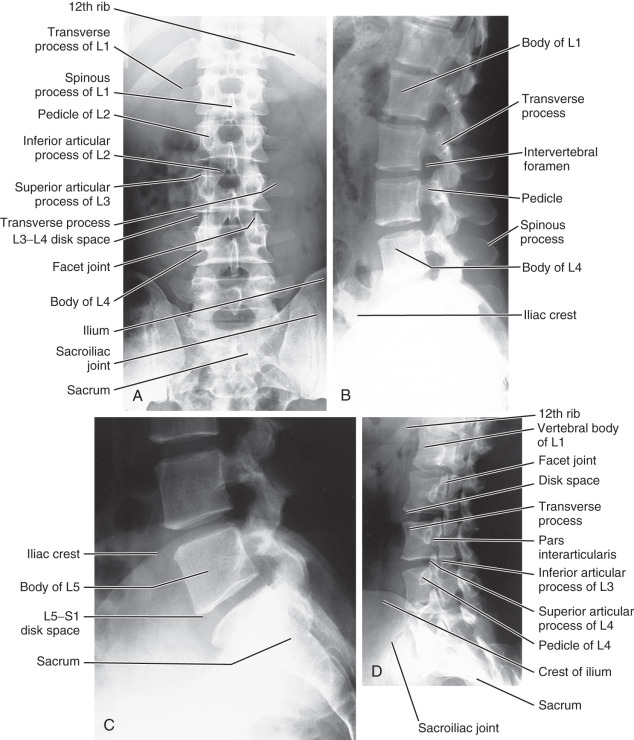
Find the location of a particular element. 4 black and white photos is located at coordinates (395, 573), (214, 573), (421, 238), (257, 238).